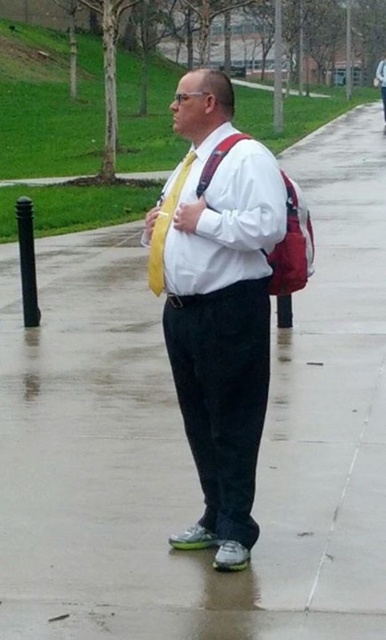
You are a photographer positioned in front of the man with the matte yellow tie at center. You want to capture a closeup shot of his face without any distortion. Considering your camera lens has a minimum focusing distance of 10 feet, will you need to step back or move closer to achieve this?

The matte yellow tie at center is 12.31 feet away from the viewer. Since your camera lens can focus as close as 10 feet, you are already beyond the minimum distance. Therefore, you can stay at your current position to capture the closeup without distortion.

The man in the scene is wearing a yellow satin tie at center and a white matte dress shirt at center. Which clothing item is shorter in height?

The yellow satin tie at center is not as tall as the white matte dress shirt at center, so the yellow satin tie at center is shorter in height.